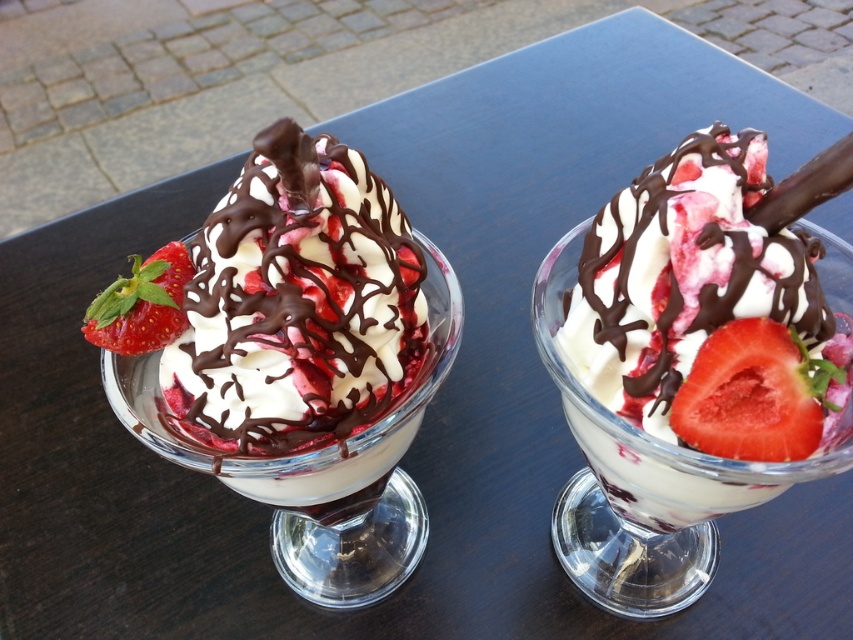
Question: Estimate the real-world distances between objects in this image. Which object is closer to the white glossy ice cream sundae at center?

Choices:
 (A) red matte strawberry at left
 (B) juicy red strawberry at right
 (C) white creamy ice cream at center

Answer: (A)

Question: Does white creamy ice cream at center have a smaller size compared to juicy red strawberry at right?

Choices:
 (A) yes
 (B) no

Answer: (B)

Question: Considering the real-world distances, which object is farthest from the white glossy ice cream sundae at center?

Choices:
 (A) juicy red strawberry at right
 (B) red matte strawberry at left

Answer: (A)

Question: Does white creamy ice cream at center appear under juicy red strawberry at right?

Choices:
 (A) no
 (B) yes

Answer: (A)

Question: Among these objects, which one is farthest from the camera?

Choices:
 (A) red matte strawberry at left
 (B) juicy red strawberry at right
 (C) white glossy ice cream sundae at center
 (D) white creamy ice cream at center

Answer: (A)

Question: Can you confirm if white glossy ice cream sundae at center is bigger than juicy red strawberry at right?

Choices:
 (A) yes
 (B) no

Answer: (A)